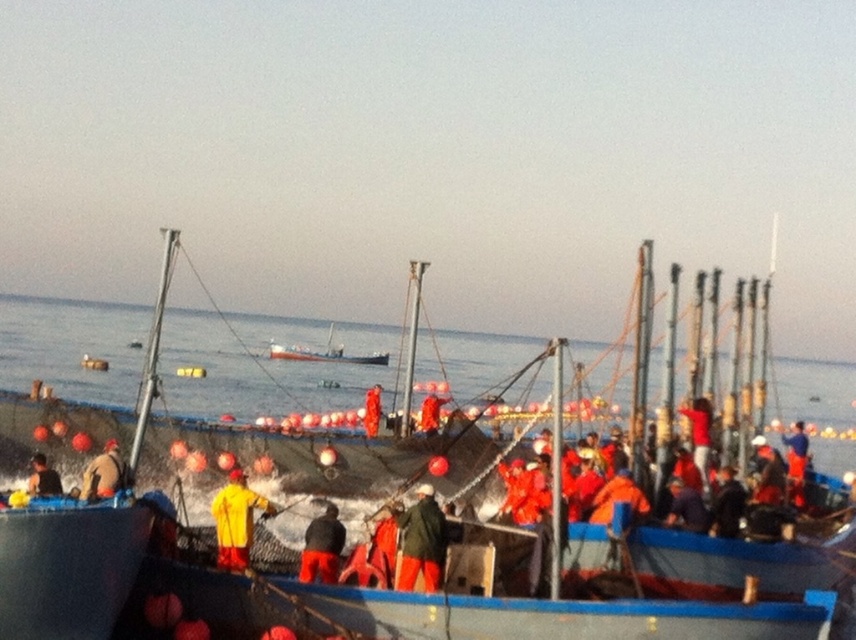
What do you see at coordinates (322, 547) in the screenshot? The height and width of the screenshot is (640, 856). I see `dark gray fabric jacket at center` at bounding box center [322, 547].

Which is more to the right, dark gray fabric jacket at center or orange fabric worker at lower left?

dark gray fabric jacket at center

What are the coordinates of `dark gray fabric jacket at center` in the screenshot? It's located at (322, 547).

This screenshot has width=856, height=640. Identify the location of dark gray fabric jacket at center. (322, 547).

Does orange fabric worker at lower left have a greater height compared to orange fabric jacket at lower left?

Correct, orange fabric worker at lower left is much taller as orange fabric jacket at lower left.

Between orange fabric worker at lower left and orange fabric jacket at lower left, which one has less height?

orange fabric jacket at lower left

Locate an element on the screen. Image resolution: width=856 pixels, height=640 pixels. orange fabric worker at lower left is located at coordinates tap(103, 474).

Is point (432, 518) less distant than point (367, 419)?

Yes, point (432, 518) is closer to viewer.

Between point (443, 554) and point (376, 416), which one is positioned in front?

Positioned in front is point (443, 554).

Locate an element on the screen. The height and width of the screenshot is (640, 856). green fabric jacket at center is located at coordinates (421, 541).